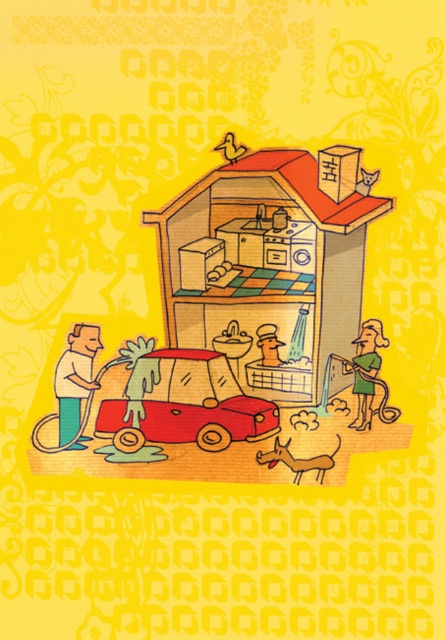
You are a visitor in this surreal car house. You notice the green rubber hose at lower right and the brown furry dog at lower center. Which object is taller?

The green rubber hose at lower right is much taller than the brown furry dog at lower center.

Looking at this image, you are a delivery robot that needs to place a package between the yellow paper man at left and the green rubber hose at lower right. The package requires a minimum of 12 inches of space. Can you fit it there?

The yellow paper man at left and green rubber hose at lower right are 12.45 inches apart, so yes, the package can fit between them as the distance is sufficient.